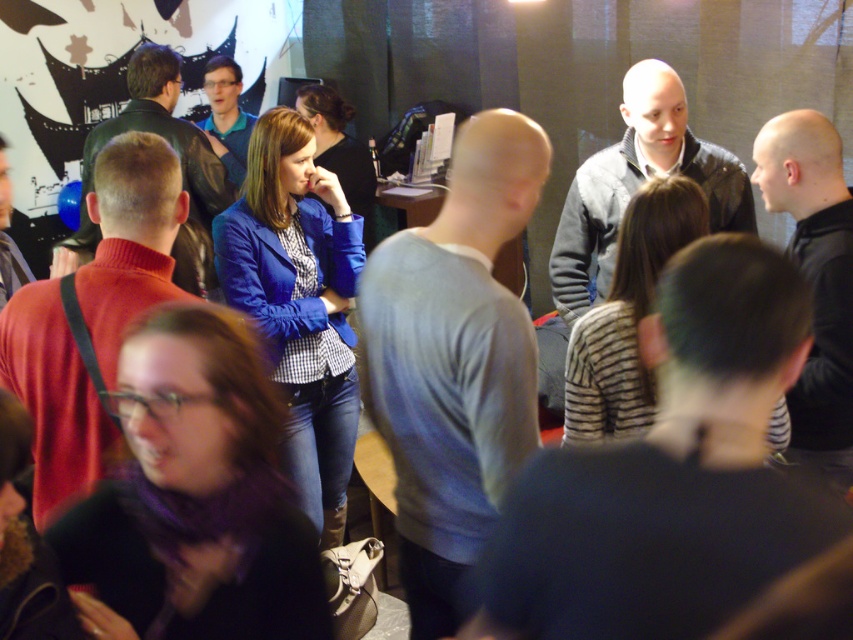
Is dark gray sweater at center above matte black jacket at upper left?

Incorrect, dark gray sweater at center is not positioned above matte black jacket at upper left.

Who is positioned more to the left, dark gray sweater at center or matte black jacket at upper left?

From the viewer's perspective, matte black jacket at upper left appears more on the left side.

Who is more distant from viewer, (727,259) or (212,282)?

The point (212,282) is more distant.

Where is `dark gray sweater at center`? dark gray sweater at center is located at coordinates (670, 474).

Between gray cotton sweater at center and matte black jacket at upper left, which one appears on the left side from the viewer's perspective?

From the viewer's perspective, matte black jacket at upper left appears more on the left side.

Identify the location of gray cotton sweater at center. This screenshot has width=853, height=640. (454, 362).

Does gray cotton sweater at center appear on the left side of red sweater at left?

Incorrect, gray cotton sweater at center is not on the left side of red sweater at left.

Image resolution: width=853 pixels, height=640 pixels. In order to click on gray cotton sweater at center in this screenshot , I will do `click(454, 362)`.